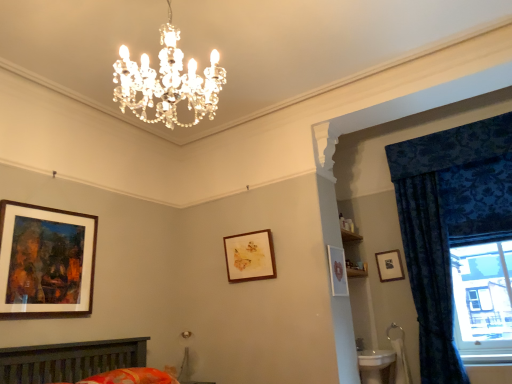
In order to face matte black picture frame at upper right, which is the 1th picture frame from back to front, should I rotate leftwards or rightwards?

You should rotate right by 17.382 degrees.

What do you see at coordinates (389, 266) in the screenshot? I see `matte black picture frame at upper right, which is the 1th picture frame from back to front` at bounding box center [389, 266].

The height and width of the screenshot is (384, 512). What do you see at coordinates (449, 222) in the screenshot?
I see `blue velvet curtain at right, the first curtain when ordered from right to left` at bounding box center [449, 222].

Identify the location of velvet blue curtain at right, which is counted as the 1th curtain, starting from the left. (429, 277).

What do you see at coordinates (429, 277) in the screenshot? This screenshot has width=512, height=384. I see `velvet blue curtain at right, acting as the 2th curtain starting from the right` at bounding box center [429, 277].

Where is `matte black picture frame at upper right, marked as the fourth picture frame in a left-to-right arrangement`? matte black picture frame at upper right, marked as the fourth picture frame in a left-to-right arrangement is located at coordinates (389, 266).

Based on the photo, is matte white picture frame at center-right, positioned as the 2th picture frame in front-to-back order, far from wooden picture frame at center, placed as the 3th picture frame when sorted from front to back?

No, there isn't a large distance between matte white picture frame at center-right, positioned as the 2th picture frame in front-to-back order, and wooden picture frame at center, placed as the 3th picture frame when sorted from front to back.

Where is `the 1st picture frame to the right of the wooden picture frame at center, positioned as the 3th picture frame in right-to-left order, counting from the anchor's position`? the 1st picture frame to the right of the wooden picture frame at center, positioned as the 3th picture frame in right-to-left order, counting from the anchor's position is located at coordinates (337, 271).

Which of these two, matte white picture frame at center-right, which appears as the second picture frame when viewed from the right, or wooden picture frame at center, the 2th picture frame from the back, is thinner?

matte white picture frame at center-right, which appears as the second picture frame when viewed from the right, is thinner.

In the scene shown: Can you tell me how much matte white picture frame at center-right, placed as the 3th picture frame when sorted from back to front, and wooden picture frame at center, positioned as the 3th picture frame in right-to-left order, differ in facing direction?

The angular difference between matte white picture frame at center-right, placed as the 3th picture frame when sorted from back to front, and wooden picture frame at center, positioned as the 3th picture frame in right-to-left order, is 90.6 degrees.

Does velvet blue curtain at right, which is counted as the 1th curtain, starting from the left, have a greater height compared to wooden-framed painting at left, which ranks as the fourth picture frame in right-to-left order?

Yes.

From a real-world perspective, relative to wooden-framed painting at left, which is the 4th picture frame from back to front, is velvet blue curtain at right, acting as the 2th curtain starting from the right, vertically above or below?

Clearly, from a real-world perspective, velvet blue curtain at right, acting as the 2th curtain starting from the right, is below wooden-framed painting at left, which is the 4th picture frame from back to front.

From the velvet blue curtain at right, which is counted as the 1th curtain, starting from the left, count the 4th picture frame to the left and point to it. Please provide its 2D coordinates.

[(46, 260)]

Is blue velvet curtain at right, the 2th curtain from the left, surrounding matte white picture frame at center-right, the third picture frame positioned from the left?

Actually, matte white picture frame at center-right, the third picture frame positioned from the left, is outside blue velvet curtain at right, the 2th curtain from the left.

From the picture: Which of these two, blue velvet curtain at right, the 2th curtain from the left, or matte white picture frame at center-right, placed as the 3th picture frame when sorted from back to front, is smaller?

Smaller between the two is matte white picture frame at center-right, placed as the 3th picture frame when sorted from back to front.

Looking at this image, which is more to the right, blue velvet curtain at right, the first curtain when ordered from right to left, or matte white picture frame at center-right, the third picture frame positioned from the left?

blue velvet curtain at right, the first curtain when ordered from right to left, is more to the right.

Does clear crystal chandelier at upper center have a lesser width compared to velvet blue curtain at right, acting as the 2th curtain starting from the right?

In fact, clear crystal chandelier at upper center might be wider than velvet blue curtain at right, acting as the 2th curtain starting from the right.

From a real-world perspective, is clear crystal chandelier at upper center physically located above or below velvet blue curtain at right, which is counted as the 1th curtain, starting from the left?

clear crystal chandelier at upper center is situated higher than velvet blue curtain at right, which is counted as the 1th curtain, starting from the left, in the real world.

Considering the sizes of clear crystal chandelier at upper center and velvet blue curtain at right, acting as the 2th curtain starting from the right, in the image, is clear crystal chandelier at upper center taller or shorter than velvet blue curtain at right, acting as the 2th curtain starting from the right,?

clear crystal chandelier at upper center is shorter than velvet blue curtain at right, acting as the 2th curtain starting from the right.

From the image's perspective, does clear crystal chandelier at upper center appear higher than velvet blue curtain at right, acting as the 2th curtain starting from the right?

Yes, from the image's perspective, clear crystal chandelier at upper center is above velvet blue curtain at right, acting as the 2th curtain starting from the right.

Between point (417, 304) and point (142, 378), which one is positioned in front?

The point (142, 378) is closer.

Does velvet blue curtain at right, acting as the 2th curtain starting from the right, have a lesser height compared to floral cotton bedspread at lower center?

No, velvet blue curtain at right, acting as the 2th curtain starting from the right, is not shorter than floral cotton bedspread at lower center.

Would you say velvet blue curtain at right, which is counted as the 1th curtain, starting from the left, is outside floral cotton bedspread at lower center?

velvet blue curtain at right, which is counted as the 1th curtain, starting from the left, lies outside floral cotton bedspread at lower center's area.

From the image's perspective, is velvet blue curtain at right, which is counted as the 1th curtain, starting from the left, below floral cotton bedspread at lower center?

No, from the image's perspective, velvet blue curtain at right, which is counted as the 1th curtain, starting from the left, is not below floral cotton bedspread at lower center.

Which is correct: blue velvet curtain at right, the first curtain when ordered from right to left, is inside velvet blue curtain at right, acting as the 2th curtain starting from the right, or outside of it?

blue velvet curtain at right, the first curtain when ordered from right to left, is not inside velvet blue curtain at right, acting as the 2th curtain starting from the right, it's outside.

From the image's perspective, which one is positioned lower, blue velvet curtain at right, the first curtain when ordered from right to left, or velvet blue curtain at right, which is counted as the 1th curtain, starting from the left?

velvet blue curtain at right, which is counted as the 1th curtain, starting from the left, is shown below in the image.

Between blue velvet curtain at right, the 2th curtain from the left, and velvet blue curtain at right, which is counted as the 1th curtain, starting from the left, which one has more height?

velvet blue curtain at right, which is counted as the 1th curtain, starting from the left.

Where is `bedding that is below the blue velvet curtain at right, the 2th curtain from the left (from the image's perspective)`? The image size is (512, 384). bedding that is below the blue velvet curtain at right, the 2th curtain from the left (from the image's perspective) is located at coordinates (132, 377).

Which is behind, point (115, 382) or point (451, 349)?

The point (451, 349) is farther.

Considering the sizes of objects floral cotton bedspread at lower center and blue velvet curtain at right, the 2th curtain from the left, in the image provided, who is taller, floral cotton bedspread at lower center or blue velvet curtain at right, the 2th curtain from the left,?

Standing taller between the two is blue velvet curtain at right, the 2th curtain from the left.

From the image's perspective, is floral cotton bedspread at lower center located beneath blue velvet curtain at right, the first curtain when ordered from right to left?

Correct, floral cotton bedspread at lower center appears lower than blue velvet curtain at right, the first curtain when ordered from right to left, in the image.

In order to click on the 1st picture frame to the left of the matte white picture frame at center-right, which appears as the second picture frame when viewed from the right, counting from the anchor's position in this screenshot , I will do point(250,256).

Identify the location of curtain that is the 2nd object located below the wooden-framed painting at left, positioned as the 1th picture frame in front-to-back order (from the image's perspective). [x=429, y=277].

Considering their positions, is velvet blue curtain at right, which is counted as the 1th curtain, starting from the left, positioned closer to matte white picture frame at center-right, placed as the 3th picture frame when sorted from back to front, than floral cotton bedspread at lower center?

velvet blue curtain at right, which is counted as the 1th curtain, starting from the left, lies closer to matte white picture frame at center-right, placed as the 3th picture frame when sorted from back to front, than the other object.

From the image, which object appears to be nearer to velvet blue curtain at right, which is counted as the 1th curtain, starting from the left, matte white picture frame at center-right, placed as the 3th picture frame when sorted from back to front, or wooden-framed painting at left, positioned as the 1th picture frame in front-to-back order?

matte white picture frame at center-right, placed as the 3th picture frame when sorted from back to front.

When comparing their distances from floral cotton bedspread at lower center, does wooden picture frame at center, positioned as the 3th picture frame in right-to-left order, or matte white picture frame at center-right, the third picture frame positioned from the left, seem closer?

wooden picture frame at center, positioned as the 3th picture frame in right-to-left order, lies closer to floral cotton bedspread at lower center than the other object.

Based on their spatial positions, is matte white picture frame at center-right, which appears as the second picture frame when viewed from the right, or floral cotton bedspread at lower center closer to blue velvet curtain at right, the first curtain when ordered from right to left?

matte white picture frame at center-right, which appears as the second picture frame when viewed from the right, is positioned closer to the anchor blue velvet curtain at right, the first curtain when ordered from right to left.

Consider the image. When comparing their distances from clear crystal chandelier at upper center, does floral cotton bedspread at lower center or wooden-framed painting at left, positioned as the 1th picture frame in front-to-back order, seem further?

floral cotton bedspread at lower center lies further to clear crystal chandelier at upper center than the other object.

From the image, which object appears to be farther from clear crystal chandelier at upper center, wooden picture frame at center, the 2th picture frame from the back, or velvet blue curtain at right, acting as the 2th curtain starting from the right?

Based on the image, velvet blue curtain at right, acting as the 2th curtain starting from the right, appears to be further to clear crystal chandelier at upper center.

When comparing their distances from floral cotton bedspread at lower center, does blue velvet curtain at right, the 2th curtain from the left, or wooden-framed painting at left, which ranks as the first picture frame in left-to-right order, seem further?

The object further to floral cotton bedspread at lower center is blue velvet curtain at right, the 2th curtain from the left.

Estimate the real-world distances between objects in this image. Which object is further from wooden-framed painting at left, which ranks as the first picture frame in left-to-right order, clear crystal chandelier at upper center or matte black picture frame at upper right, the 4th picture frame in the front-to-back sequence?

Among the two, matte black picture frame at upper right, the 4th picture frame in the front-to-back sequence, is located further to wooden-framed painting at left, which ranks as the first picture frame in left-to-right order.

Identify the location of bedding positioned between clear crystal chandelier at upper center and matte black picture frame at upper right, the first picture frame positioned from the right, from near to far. Image resolution: width=512 pixels, height=384 pixels. (132, 377).

You are a GUI agent. You are given a task and a screenshot of the screen. Output one action in this format:
    pyautogui.click(x=<x>, y=<y>)
    Task: Click on the bedding between wooden-framed painting at left, which ranks as the fourth picture frame in right-to-left order, and velvet blue curtain at right, acting as the 2th curtain starting from the right
    This screenshot has width=512, height=384.
    Given the screenshot: What is the action you would take?
    pyautogui.click(x=132, y=377)

Locate an element on the screen. The image size is (512, 384). picture frame located between floral cotton bedspread at lower center and matte white picture frame at center-right, placed as the 3th picture frame when sorted from back to front, in the left-right direction is located at coordinates (250, 256).

The image size is (512, 384). Identify the location of curtain between clear crystal chandelier at upper center and blue velvet curtain at right, the first curtain when ordered from right to left. (429, 277).